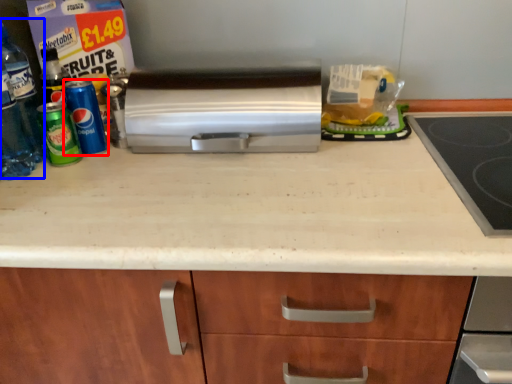
Question: Which object is closer to the camera taking this photo, beverage (highlighted by a red box) or bottle (highlighted by a blue box)?

Choices:
 (A) beverage
 (B) bottle

Answer: (B)